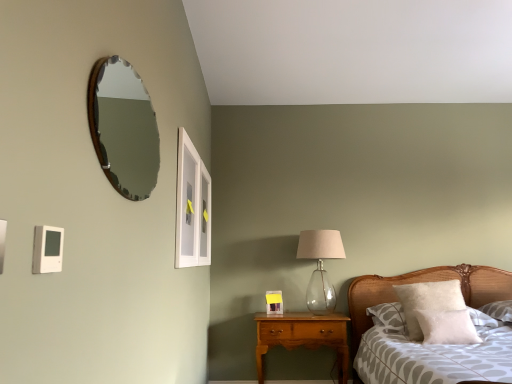
What is the approximate width of cherry wood nightstand at center?

It is 14.88 inches.

This screenshot has height=384, width=512. Find the location of `matte white picture frame at center`. matte white picture frame at center is located at coordinates (274, 302).

In order to face clear glass window at upper center, should I rotate leftwards or rightwards?

You should look left and rotate roughly 8.573 degrees.

Looking at this image, what is the approximate width of wooden-framed mirror at upper left?

2.76 inches.

The width and height of the screenshot is (512, 384). Describe the element at coordinates (437, 313) in the screenshot. I see `white fluffy pillow at right, placed as the first pillow when sorted from back to front` at that location.

Where is `white fluffy pillow at right, which appears as the 1th pillow when viewed from the front`? The height and width of the screenshot is (384, 512). white fluffy pillow at right, which appears as the 1th pillow when viewed from the front is located at coordinates (447, 327).

Based on the photo, is matte white picture frame at center turned away from clear glass window at upper center?

No, matte white picture frame at center's orientation is not away from clear glass window at upper center.

Considering the positions of objects matte white picture frame at center and clear glass window at upper center in the image provided, who is more to the left, matte white picture frame at center or clear glass window at upper center?

clear glass window at upper center.

Is there a large distance between matte white picture frame at center and clear glass window at upper center?

Absolutely, matte white picture frame at center is distant from clear glass window at upper center.

Can you confirm if matte white picture frame at center is smaller than clear glass window at upper center?

Yes, matte white picture frame at center is smaller than clear glass window at upper center.

Between clear glass window at upper center and patterned fabric bed at lower right, which one has larger size?

patterned fabric bed at lower right.

Which is in front, point (181, 246) or point (351, 318)?

Positioned in front is point (181, 246).

Looking at their sizes, would you say clear glass window at upper center is wider or thinner than patterned fabric bed at lower right?

Clearly, clear glass window at upper center has less width compared to patterned fabric bed at lower right.

From the image's perspective, is matte white picture frame at center beneath white fluffy pillow at right, marked as the 2th pillow in a front-to-back arrangement?

Yes, from the image's perspective, matte white picture frame at center is below white fluffy pillow at right, marked as the 2th pillow in a front-to-back arrangement.

In terms of size, does matte white picture frame at center appear bigger or smaller than white fluffy pillow at right, placed as the first pillow when sorted from back to front?

Clearly, matte white picture frame at center is smaller in size than white fluffy pillow at right, placed as the first pillow when sorted from back to front.

Would you say matte white picture frame at center is to the left or to the right of white fluffy pillow at right, placed as the first pillow when sorted from back to front, in the picture?

matte white picture frame at center is positioned on white fluffy pillow at right, placed as the first pillow when sorted from back to front,'s left side.

Would you say matte white picture frame at center is outside white fluffy pillow at right, marked as the 2th pillow in a front-to-back arrangement?

That's correct, matte white picture frame at center is outside of white fluffy pillow at right, marked as the 2th pillow in a front-to-back arrangement.

Considering the relative sizes of wooden-framed mirror at upper left and clear glass window at upper center in the image provided, is wooden-framed mirror at upper left wider than clear glass window at upper center?

Yes, wooden-framed mirror at upper left is wider than clear glass window at upper center.

Is wooden-framed mirror at upper left taller than clear glass window at upper center?

No.

From a real-world perspective, is wooden-framed mirror at upper left positioned over clear glass window at upper center based on gravity?

Indeed, from a real-world perspective, wooden-framed mirror at upper left stands above clear glass window at upper center.

Do you think wooden-framed mirror at upper left is within white fluffy pillow at right, which is the 2th pillow from back to front, or outside of it?

The correct answer is: outside.

The height and width of the screenshot is (384, 512). Find the location of `mirror above the white fluffy pillow at right, which is the 2th pillow from back to front (from a real-world perspective)`. mirror above the white fluffy pillow at right, which is the 2th pillow from back to front (from a real-world perspective) is located at coordinates (123, 128).

Based on the photo, from the image's perspective, relative to white fluffy pillow at right, which appears as the 1th pillow when viewed from the front, is wooden-framed mirror at upper left above or below?

wooden-framed mirror at upper left is above white fluffy pillow at right, which appears as the 1th pillow when viewed from the front.

Between wooden-framed mirror at upper left and white fluffy pillow at right, which appears as the 1th pillow when viewed from the front, which one has smaller size?

Smaller between the two is white fluffy pillow at right, which appears as the 1th pillow when viewed from the front.

From their relative heights in the image, would you say white fluffy pillow at right, which appears as the 1th pillow when viewed from the front, is taller or shorter than clear glass window at upper center?

Considering their sizes, white fluffy pillow at right, which appears as the 1th pillow when viewed from the front, has less height than clear glass window at upper center.

From the picture: Is white fluffy pillow at right, which is the 2th pillow from back to front, behind clear glass window at upper center?

Yes.

From a real-world perspective, which is physically above, white fluffy pillow at right, which appears as the 1th pillow when viewed from the front, or clear glass window at upper center?

From a 3D spatial view, clear glass window at upper center is above.

In the scene shown: Which point is more distant from viewer, (459, 329) or (189, 225)?

The point (459, 329) is behind.

From the image's perspective, which one is positioned higher, cherry wood nightstand at center or white fluffy pillow at right, placed as the first pillow when sorted from back to front?

white fluffy pillow at right, placed as the first pillow when sorted from back to front.

Locate an element on the screen. This screenshot has width=512, height=384. nightstand that appears behind the white fluffy pillow at right, marked as the 2th pillow in a front-to-back arrangement is located at coordinates (303, 336).

Could you tell me if cherry wood nightstand at center is facing white fluffy pillow at right, marked as the 2th pillow in a front-to-back arrangement?

No.

Which is farther, (258, 373) or (473, 340)?

The point (258, 373) is farther.

Image resolution: width=512 pixels, height=384 pixels. Find the location of `window on the left of the matte white picture frame at center`. window on the left of the matte white picture frame at center is located at coordinates (191, 206).

Find the location of a particular element. The image size is (512, 384). window that is behind the patterned fabric bed at lower right is located at coordinates (191, 206).

Based on the photo, based on their spatial positions, is translucent glass table lamp at center-right or white fluffy pillow at right, which is the 2th pillow from back to front, further from clear glass window at upper center?

white fluffy pillow at right, which is the 2th pillow from back to front, is further to clear glass window at upper center.

From the image, which object appears to be nearer to clear glass window at upper center, translucent glass table lamp at center-right or wooden-framed mirror at upper left?

translucent glass table lamp at center-right.

Based on their spatial positions, is wooden-framed mirror at upper left or cherry wood nightstand at center further from translucent glass table lamp at center-right?

The object further to translucent glass table lamp at center-right is wooden-framed mirror at upper left.

When comparing their distances from cherry wood nightstand at center, does white fluffy pillow at right, marked as the 2th pillow in a front-to-back arrangement, or clear glass window at upper center seem closer?

white fluffy pillow at right, marked as the 2th pillow in a front-to-back arrangement, lies closer to cherry wood nightstand at center than the other object.

Based on their spatial positions, is white fluffy pillow at right, marked as the 2th pillow in a front-to-back arrangement, or clear glass window at upper center further from patterned fabric bed at lower right?

The object further to patterned fabric bed at lower right is clear glass window at upper center.

Estimate the real-world distances between objects in this image. Which object is closer to matte white picture frame at center, white fluffy pillow at right, which is the 2th pillow from back to front, or wooden-framed mirror at upper left?

white fluffy pillow at right, which is the 2th pillow from back to front.

Based on their spatial positions, is translucent glass table lamp at center-right or patterned fabric bed at lower right further from wooden-framed mirror at upper left?

patterned fabric bed at lower right is positioned further to the anchor wooden-framed mirror at upper left.

Considering their positions, is clear glass window at upper center positioned closer to matte white picture frame at center than translucent glass table lamp at center-right?

translucent glass table lamp at center-right.

In order to click on table lamp between clear glass window at upper center and white fluffy pillow at right, placed as the first pillow when sorted from back to front, from left to right in this screenshot , I will do `click(320, 267)`.

Find the location of `table lamp between patterned fabric bed at lower right and matte white picture frame at center from front to back`. table lamp between patterned fabric bed at lower right and matte white picture frame at center from front to back is located at coordinates (320, 267).

You are a GUI agent. You are given a task and a screenshot of the screen. Output one action in this format:
    pyautogui.click(x=<x>, y=<y>)
    Task: Click on the table lamp between cherry wood nightstand at center and white fluffy pillow at right, marked as the 2th pillow in a front-to-back arrangement, from left to right
    
    Given the screenshot: What is the action you would take?
    pyautogui.click(x=320, y=267)

At what (x,y) coordinates should I click in order to perform the action: click on pillow between clear glass window at upper center and white fluffy pillow at right, marked as the 2th pillow in a front-to-back arrangement. Please return your answer as a coordinate pair (x, y). Looking at the image, I should click on tap(447, 327).